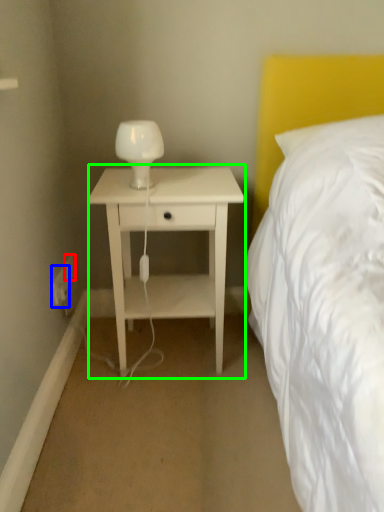
Question: Estimate the real-world distances between objects in this image. Which object is closer to electric outlet (highlighted by a red box), electric outlet (highlighted by a blue box) or nightstand (highlighted by a green box)?

Choices:
 (A) electric outlet
 (B) nightstand

Answer: (A)